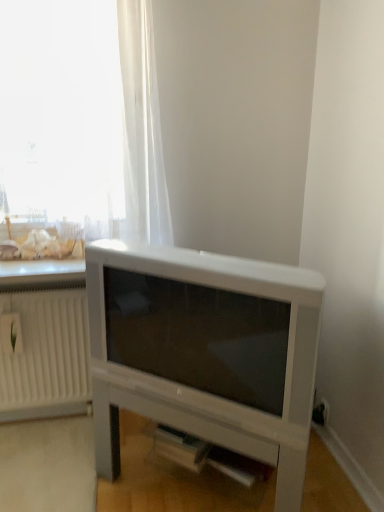
Question: Is white plastic radiator at left wider than transparent fabric at upper left?

Choices:
 (A) no
 (B) yes

Answer: (A)

Question: Is white plastic radiator at left closer to the viewer compared to transparent fabric at upper left?

Choices:
 (A) no
 (B) yes

Answer: (A)

Question: From the image's perspective, is white plastic radiator at left on top of transparent fabric at upper left?

Choices:
 (A) no
 (B) yes

Answer: (A)

Question: Can you see white plastic radiator at left touching transparent fabric at upper left?

Choices:
 (A) yes
 (B) no

Answer: (B)

Question: Considering the relative sizes of white plastic radiator at left and transparent fabric at upper left in the image provided, is white plastic radiator at left thinner than transparent fabric at upper left?

Choices:
 (A) no
 (B) yes

Answer: (B)

Question: Would you say white plastic radiator at left is to the left or to the right of white matte entertainment center at lower center in the picture?

Choices:
 (A) left
 (B) right

Answer: (A)

Question: From the image's perspective, is white plastic radiator at left above or below white matte entertainment center at lower center?

Choices:
 (A) above
 (B) below

Answer: (A)

Question: Is white plastic radiator at left in front of or behind white matte entertainment center at lower center in the image?

Choices:
 (A) behind
 (B) front

Answer: (A)

Question: Is white plastic radiator at left inside or outside of white matte entertainment center at lower center?

Choices:
 (A) inside
 (B) outside

Answer: (B)

Question: Is point (92, 118) positioned closer to the camera than point (66, 335)?

Choices:
 (A) farther
 (B) closer

Answer: (B)

Question: From a real-world perspective, is transparent fabric at upper left above or below white plastic radiator at left?

Choices:
 (A) below
 (B) above

Answer: (B)

Question: Is transparent fabric at upper left bigger or smaller than white plastic radiator at left?

Choices:
 (A) big
 (B) small

Answer: (A)

Question: Considering the positions of transparent fabric at upper left and white plastic radiator at left in the image, is transparent fabric at upper left taller or shorter than white plastic radiator at left?

Choices:
 (A) tall
 (B) short

Answer: (A)

Question: Is white matte entertainment center at lower center wider or thinner than transparent fabric at upper left?

Choices:
 (A) wide
 (B) thin

Answer: (A)

Question: In terms of height, does white matte entertainment center at lower center look taller or shorter compared to transparent fabric at upper left?

Choices:
 (A) tall
 (B) short

Answer: (B)